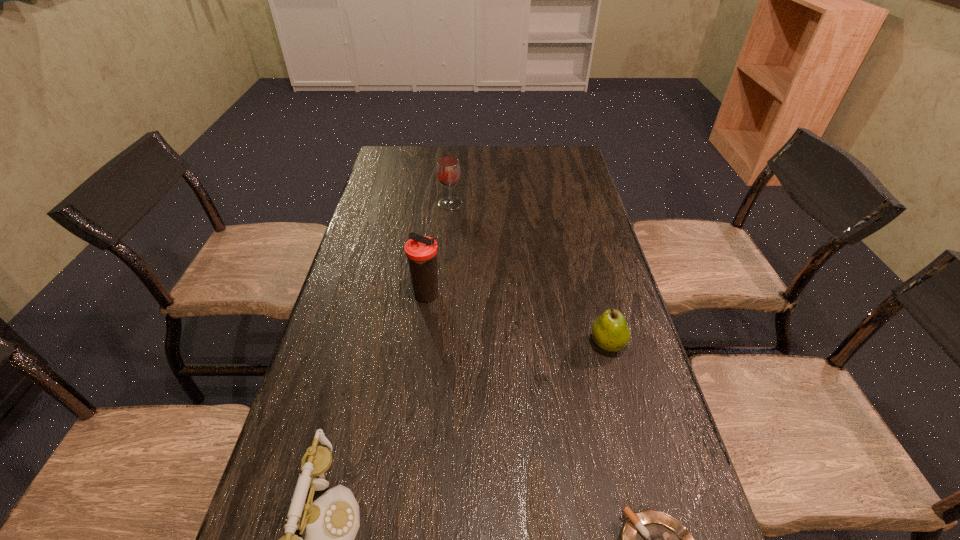
Locate an element on the screen. This screenshot has width=960, height=540. free location at the right edge is located at coordinates (559, 235).

Locate an element on the screen. free space at the far left corner of the desktop is located at coordinates (415, 161).

I want to click on vacant region at the far right corner, so click(x=541, y=147).

You are a GUI agent. You are given a task and a screenshot of the screen. Output one action in this format:
    pyautogui.click(x=<x>, y=<y>)
    Task: Click on the free space between the wineglass and the thermos bottle
    This screenshot has height=540, width=960.
    Given the screenshot: What is the action you would take?
    pyautogui.click(x=439, y=250)

Locate an element on the screen. The image size is (960, 540). empty space that is in between the third nearest object and the wineglass is located at coordinates (529, 274).

Identify the location of vacant space in between the tallest object and the farthest object. (439, 250).

Find the location of a particular element. empty location between the pear and the wineglass is located at coordinates (529, 274).

I want to click on free area in between the second farthest object and the wineglass, so click(439, 250).

Select which object appears as the second closest to the fourth nearest object. Please provide its 2D coordinates. Your answer should be formatted as a tuple, i.e. [(x, y)], where the tuple contains the x and y coordinates of a point satisfying the conditions above.

[(610, 332)]

Locate which object is the third closest to the shortest object. Please provide its 2D coordinates. Your answer should be formatted as a tuple, i.e. [(x, y)], where the tuple contains the x and y coordinates of a point satisfying the conditions above.

[(421, 251)]